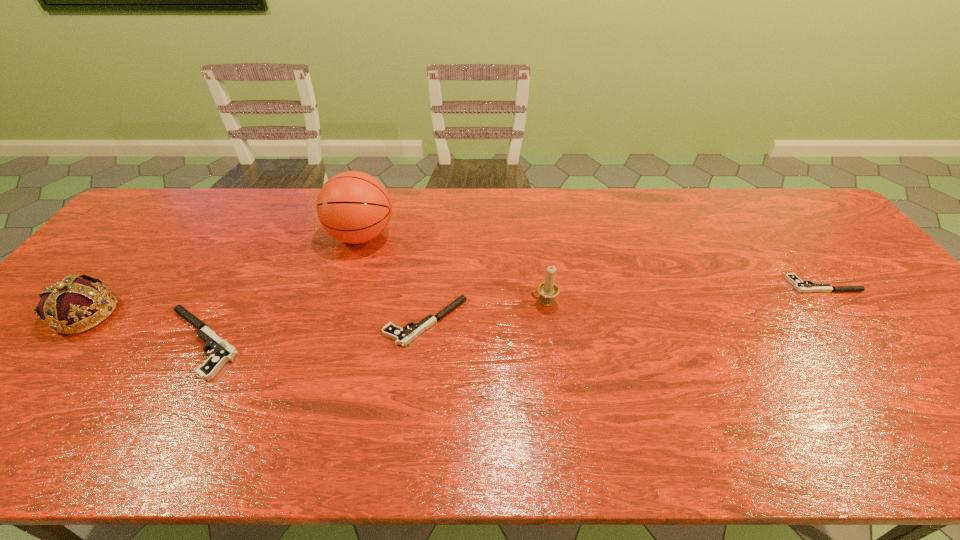
Locate an element on the screen. free space between the candle_holder and the rightmost pistol is located at coordinates (684, 294).

Where is `free space between the leftmost object and the second object from left to right`? The width and height of the screenshot is (960, 540). free space between the leftmost object and the second object from left to right is located at coordinates (143, 328).

Find the location of a particular element. free point between the fourth object from right to left and the leftmost pistol is located at coordinates (281, 289).

Find the location of a particular element. vacant region between the rightmost object and the fifth tallest object is located at coordinates (624, 303).

Locate an element on the screen. The height and width of the screenshot is (540, 960). free spot between the farthest object and the second object from left to right is located at coordinates (281, 289).

This screenshot has width=960, height=540. In order to click on free space between the shortest object and the second object from right to left in this screenshot , I will do [x=684, y=294].

At what (x,y) coordinates should I click in order to perform the action: click on unoccupied position between the leftmost object and the second shortest pistol. Please return your answer as a coordinate pair (x, y). The image size is (960, 540). Looking at the image, I should click on (255, 318).

This screenshot has width=960, height=540. Find the location of `vacant space in between the candle_holder and the second tallest pistol`. vacant space in between the candle_holder and the second tallest pistol is located at coordinates (485, 313).

The height and width of the screenshot is (540, 960). Find the location of `unoccupied position between the rightmost pistol and the fifth tallest object`. unoccupied position between the rightmost pistol and the fifth tallest object is located at coordinates (624, 303).

Find the location of a particular element. The image size is (960, 540). empty space between the second object from right to left and the crown is located at coordinates (315, 309).